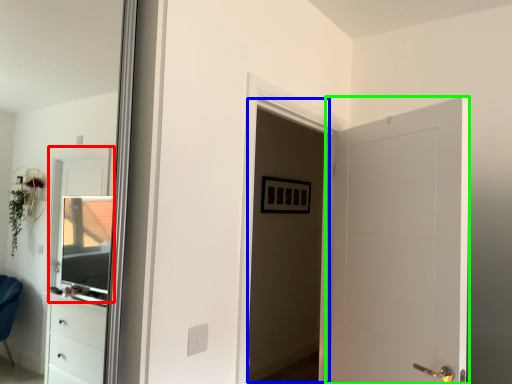
Question: Based on their relative distances, which object is nearer to window (highlighted by a red box)? Choose from screen door (highlighted by a blue box) and door (highlighted by a green box).

Choices:
 (A) screen door
 (B) door

Answer: (A)